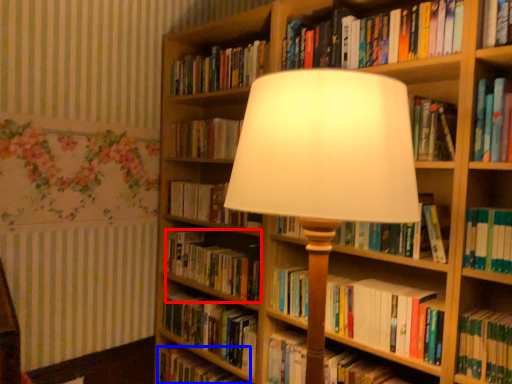
Question: Which point is closer to the camera, book (highlighted by a red box) or book (highlighted by a blue box)?

Choices:
 (A) book
 (B) book

Answer: (A)